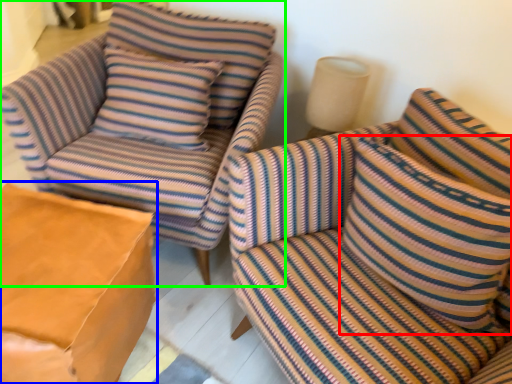
Question: Estimate the real-world distances between objects in this image. Which object is closer to pillow (highlighted by a red box), table (highlighted by a blue box) or chair (highlighted by a green box)?

Choices:
 (A) table
 (B) chair

Answer: (B)